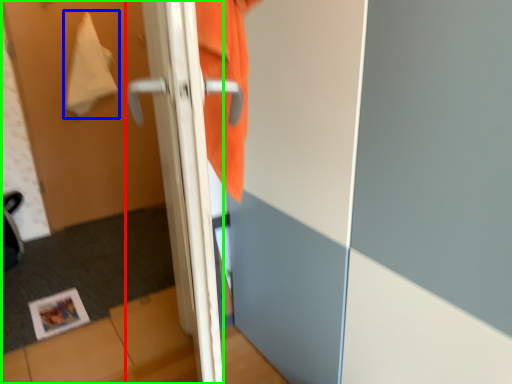
Question: Which is nearer to the door (highlighted by a red box)? blanket (highlighted by a blue box) or screen door (highlighted by a green box).

Choices:
 (A) blanket
 (B) screen door

Answer: (B)